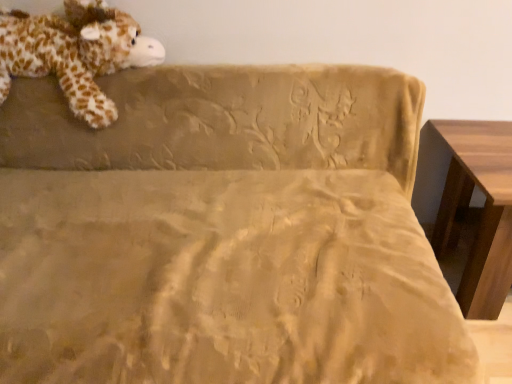
The image size is (512, 384). What do you see at coordinates (75, 53) in the screenshot?
I see `soft plush giraffe at upper left` at bounding box center [75, 53].

Find the location of a particular element. Image resolution: width=512 pixels, height=384 pixels. soft plush giraffe at upper left is located at coordinates (75, 53).

What is the approximate width of wooden table at right?

wooden table at right is 22.53 inches in width.

This screenshot has height=384, width=512. I want to click on wooden table at right, so click(x=483, y=211).

Describe the element at coordinates (483, 211) in the screenshot. The width and height of the screenshot is (512, 384). I see `wooden table at right` at that location.

Where is `soft plush giraffe at upper left`? soft plush giraffe at upper left is located at coordinates (75, 53).

Considering the positions of objects wooden table at right and soft plush giraffe at upper left in the image provided, who is more to the right, wooden table at right or soft plush giraffe at upper left?

Answer: wooden table at right.

Is the depth of wooden table at right greater than that of soft plush giraffe at upper left?

No, wooden table at right is closer to the camera.

Which is farther from the camera, (x=500, y=247) or (x=34, y=40)?

Point (x=34, y=40)

From the image's perspective, is wooden table at right above soft plush giraffe at upper left?

Actually, wooden table at right appears below soft plush giraffe at upper left in the image.

From a real-world perspective, is wooden table at right positioned above or below soft plush giraffe at upper left?

Clearly, from a real-world perspective, wooden table at right is below soft plush giraffe at upper left.

Considering the sizes of objects wooden table at right and soft plush giraffe at upper left in the image provided, who is thinner, wooden table at right or soft plush giraffe at upper left?

soft plush giraffe at upper left.

Looking at this image, considering the sizes of objects wooden table at right and soft plush giraffe at upper left in the image provided, who is taller, wooden table at right or soft plush giraffe at upper left?

soft plush giraffe at upper left is taller.

In terms of size, does wooden table at right appear bigger or smaller than soft plush giraffe at upper left?

In the image, wooden table at right appears to be larger than soft plush giraffe at upper left.

Would you say soft plush giraffe at upper left is part of wooden table at right's contents?

Definitely not — soft plush giraffe at upper left is not inside wooden table at right.

Is wooden table at right far away from soft plush giraffe at upper left?

Yes.

Is wooden table at right looking in the opposite direction of soft plush giraffe at upper left?

No, soft plush giraffe at upper left is not at the back of wooden table at right.

At what (x,y) coordinates should I click in order to perform the action: click on animal lying behind the wooden table at right. Please return your answer as a coordinate pair (x, y). The width and height of the screenshot is (512, 384). Looking at the image, I should click on (75, 53).

Considering the relative positions of soft plush giraffe at upper left and wooden table at right in the image provided, is soft plush giraffe at upper left to the left or to the right of wooden table at right?

Based on their positions, soft plush giraffe at upper left is located to the left of wooden table at right.

Based on the photo, relative to wooden table at right, is soft plush giraffe at upper left in front or behind?

In the image, soft plush giraffe at upper left appears behind wooden table at right.

Considering the points (27, 57) and (508, 180), which point is behind, point (27, 57) or point (508, 180)?

Point (27, 57)

From the image's perspective, who appears lower, soft plush giraffe at upper left or wooden table at right?

wooden table at right.

From a real-world perspective, which is physically below, soft plush giraffe at upper left or wooden table at right?

wooden table at right, from a real-world perspective.

Which of these two, soft plush giraffe at upper left or wooden table at right, is thinner?

Thinner between the two is soft plush giraffe at upper left.

Does soft plush giraffe at upper left have a greater height compared to wooden table at right?

Indeed, soft plush giraffe at upper left has a greater height compared to wooden table at right.

Consider the image. Is soft plush giraffe at upper left bigger or smaller than wooden table at right?

Considering their sizes, soft plush giraffe at upper left takes up less space than wooden table at right.

Is wooden table at right a part of soft plush giraffe at upper left?

No, wooden table at right is not surrounded by soft plush giraffe at upper left.

Are soft plush giraffe at upper left and wooden table at right located far from each other?

soft plush giraffe at upper left is positioned a significant distance from wooden table at right.

Does soft plush giraffe at upper left turn towards wooden table at right?

No, soft plush giraffe at upper left is not turned towards wooden table at right.

What's the angular difference between soft plush giraffe at upper left and wooden table at right's facing directions?

soft plush giraffe at upper left and wooden table at right are facing 0.0194 degrees away from each other.

Find the location of a particular element. animal lying above the wooden table at right (from the image's perspective) is located at coordinates (75, 53).

This screenshot has height=384, width=512. I want to click on table on the right of soft plush giraffe at upper left, so click(x=483, y=211).

Identify the location of table below the soft plush giraffe at upper left (from the image's perspective). The width and height of the screenshot is (512, 384). (483, 211).